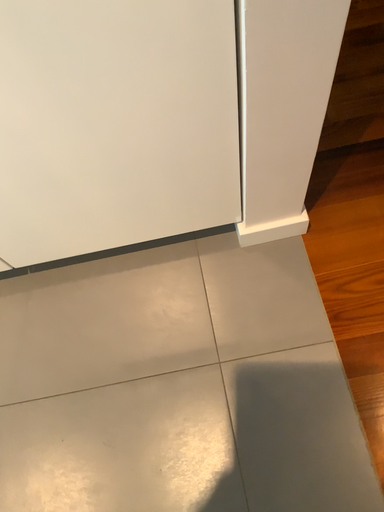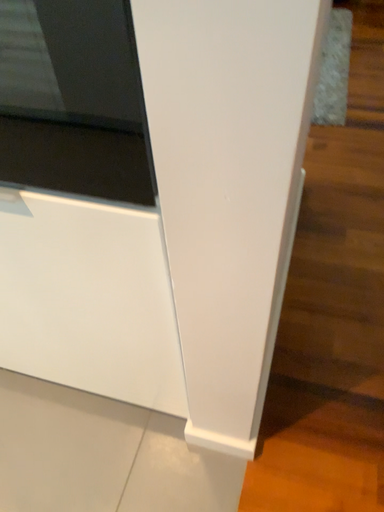
Question: Which way did the camera rotate in the video?

Choices:
 (A) rotated downward
 (B) rotated upward

Answer: (B)